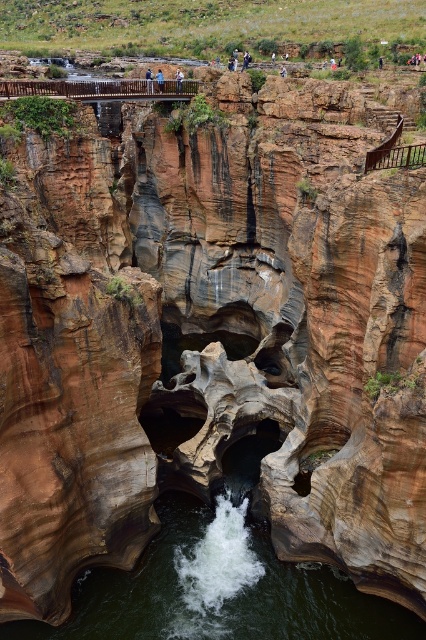
You are hiking along the edge of a canyon and notice two pairs of jeans stuck in the rocks. The blue denim jeans at upper center and the light blue jeans at center. Which pair is higher up the canyon wall?

The blue denim jeans at upper center is higher up the canyon wall than the light blue jeans at center because it is taller than the light blue jeans at center.

You are standing at the edge of the canyon and see a brown smooth rock at center and light blue jeans at center. Which object is closer to the bottom of the canyon?

The brown smooth rock at center is closer to the bottom of the canyon because it is positioned below the light blue jeans at center.

You are standing at the edge of the canyon and see the brown smooth rock at center and the blue denim jeans at upper center. Which object is closer to you?

The brown smooth rock at center is closer to you because it is in front of the blue denim jeans at upper center.